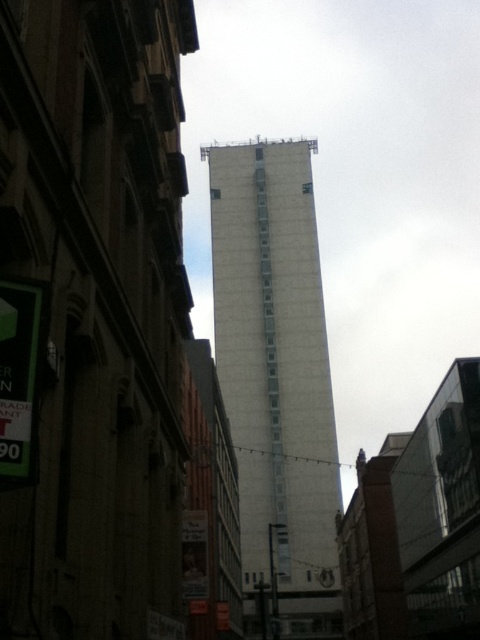
Question: Which point is farther to the camera?

Choices:
 (A) white concrete tower at center
 (B) green plastic sign at left

Answer: (A)

Question: Is white concrete tower at center thinner than green plastic sign at left?

Choices:
 (A) no
 (B) yes

Answer: (A)

Question: From the image, what is the correct spatial relationship of white concrete tower at center in relation to green plastic sign at left?

Choices:
 (A) right
 (B) left

Answer: (A)

Question: Is white concrete tower at center further to camera compared to green plastic sign at left?

Choices:
 (A) no
 (B) yes

Answer: (B)